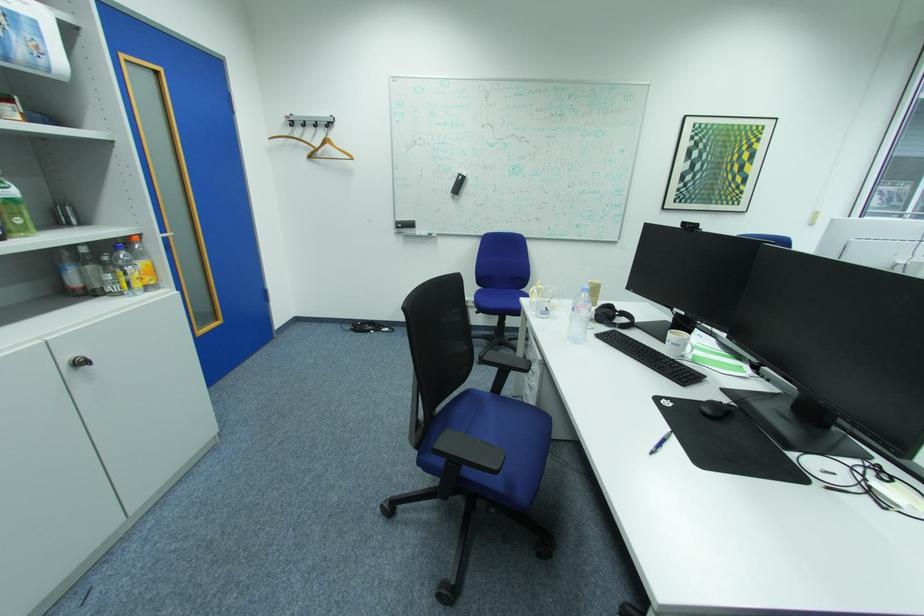
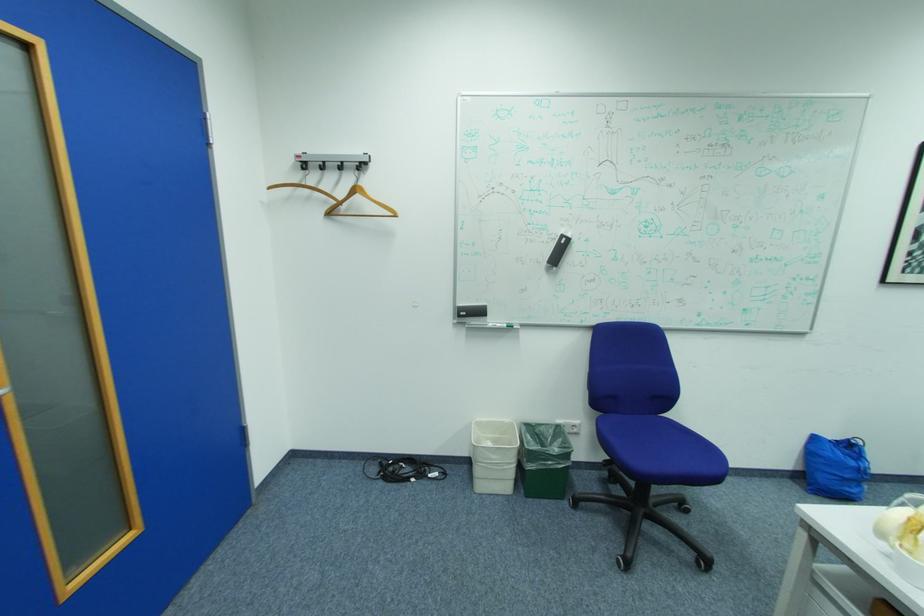
Locate, in the second image, the point that corresponds to the point at 320,156 in the first image.

(337, 214)